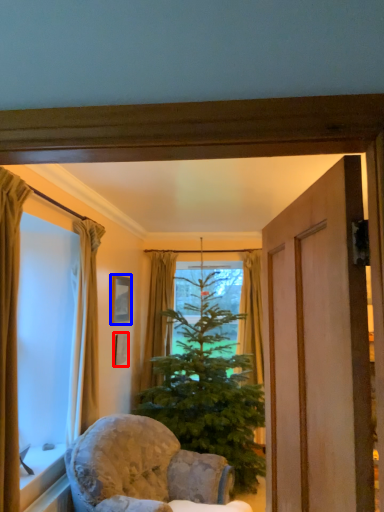
Question: Which object is closer to the camera taking this photo, picture frame (highlighted by a red box) or picture frame (highlighted by a blue box)?

Choices:
 (A) picture frame
 (B) picture frame

Answer: (B)